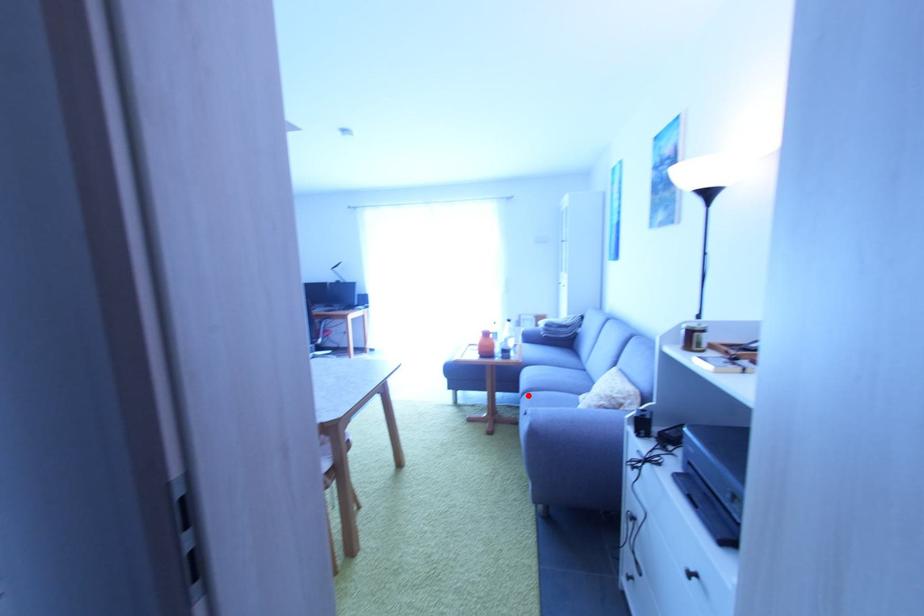
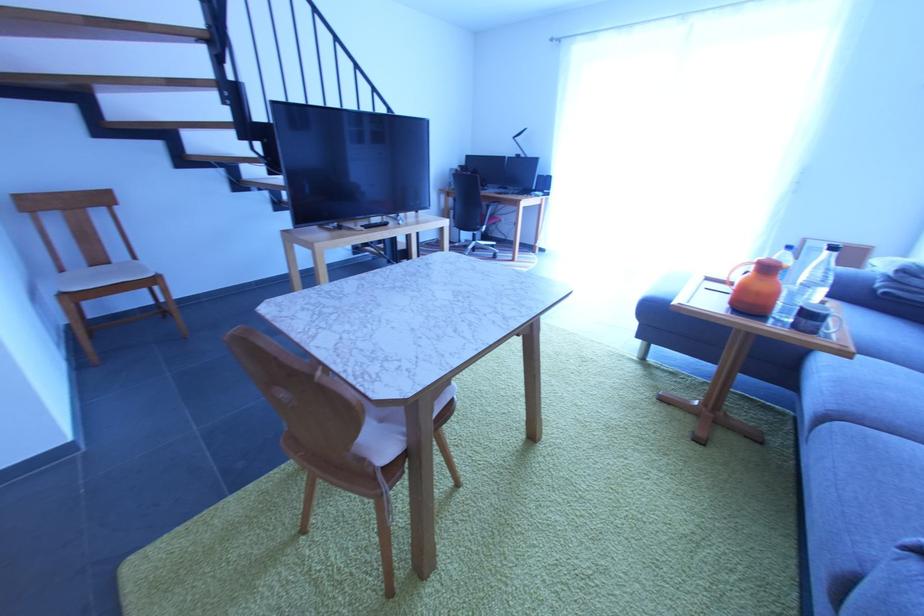
Question: I am providing you with two images of the same scene from different viewpoints. In image1, a red point is highlighted. Considering the same 3D point in image2, which of the following is correct?

Choices:
 (A) It is closer
 (B) It is farther

Answer: (B)